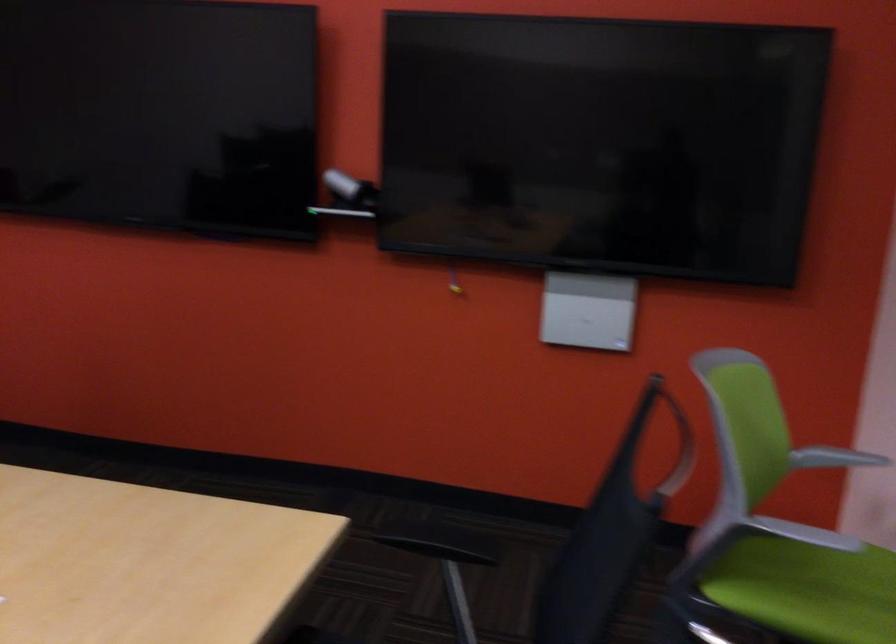
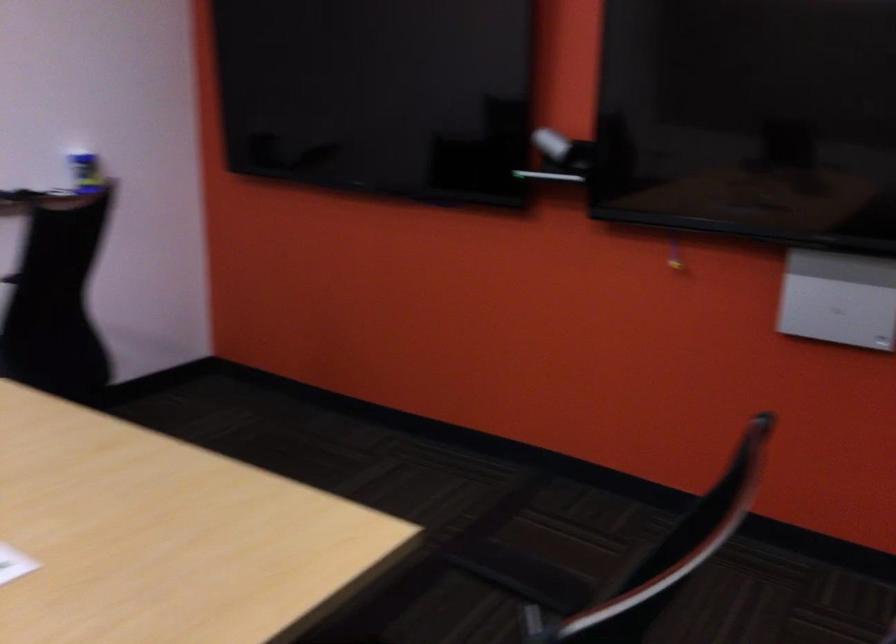
Question: Based on the continuous images, in which direction is the camera rotating? Reply with the corresponding letter.

Choices:
 (A) Left
 (B) Right
 (C) Up
 (D) Down

Answer: (A)